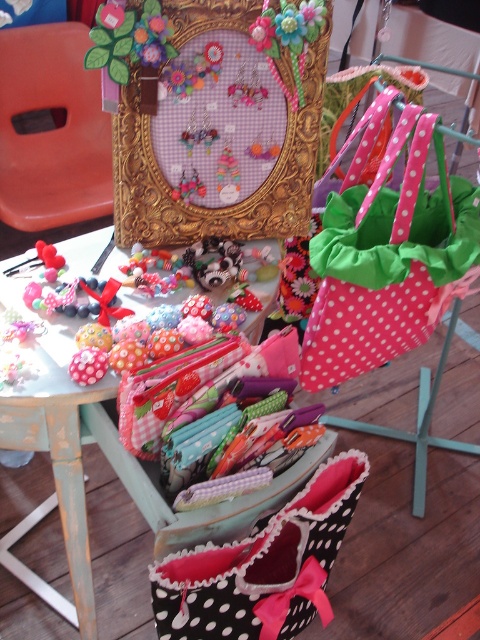
Question: Is black polka dot fabric gift bag at center to the left of smooth orange chair at upper left from the viewer's perspective?

Choices:
 (A) no
 (B) yes

Answer: (A)

Question: Can you confirm if goldmetallicpicture frame at upper center is positioned to the left of pink polka dot fabric bag at center?

Choices:
 (A) no
 (B) yes

Answer: (B)

Question: Which of the following is the closest to the observer?

Choices:
 (A) black polka dot fabric gift bag at center
 (B) goldmetallicpicture frame at upper center
 (C) smooth orange chair at upper left
 (D) pink polka dot fabric bag at center

Answer: (A)

Question: Which point is farther to the camera?

Choices:
 (A) (x=3, y=134)
 (B) (x=191, y=564)
 (C) (x=271, y=84)
 (D) (x=442, y=182)

Answer: (A)

Question: Which object is positioned closest to the goldmetallicpicture frame at upper center?

Choices:
 (A) black polka dot fabric gift bag at center
 (B) smooth orange chair at upper left

Answer: (A)

Question: Can you confirm if wooden table at center is thinner than smooth orange chair at upper left?

Choices:
 (A) yes
 (B) no

Answer: (B)